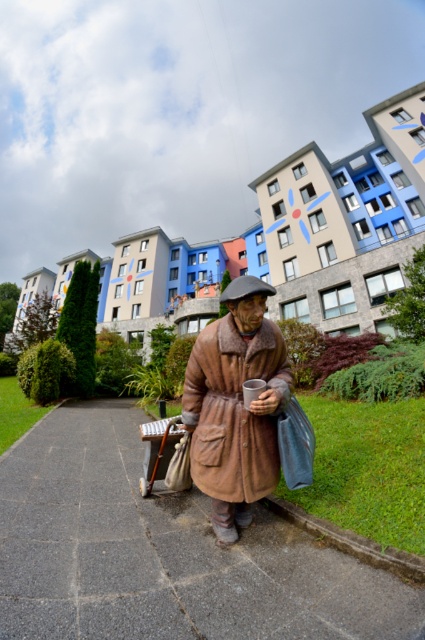
Question: Does smooth concrete pavement at center appear over gray concrete curb at lower center?

Choices:
 (A) no
 (B) yes

Answer: (B)

Question: Does smooth concrete pavement at center appear under brown woolen coat at center?

Choices:
 (A) no
 (B) yes

Answer: (B)

Question: Which object is the farthest from the smooth concrete pavement at center?

Choices:
 (A) gray concrete curb at lower center
 (B) brown woolen coat at center

Answer: (B)

Question: Is smooth concrete pavement at center behind brown woolen coat at center?

Choices:
 (A) yes
 (B) no

Answer: (B)

Question: Which point is farther to the camera?

Choices:
 (A) (133, 474)
 (B) (413, 573)

Answer: (A)

Question: Which point is closer to the camera?

Choices:
 (A) (348, 538)
 (B) (195, 378)
 (C) (133, 410)

Answer: (A)